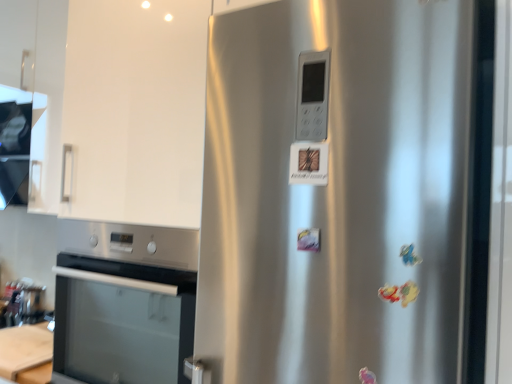
Question: In terms of size, does stainless steel oven at lower left appear bigger or smaller than brushed metal toaster at lower left?

Choices:
 (A) small
 (B) big

Answer: (B)

Question: Visually, is stainless steel oven at lower left positioned to the left or to the right of brushed metal toaster at lower left?

Choices:
 (A) right
 (B) left

Answer: (A)

Question: Based on their relative distances, which object is nearer to the wooden at lower left?

Choices:
 (A) satin silver fridge at center
 (B) satin white exhaust hood at upper left
 (C) brushed metal toaster at lower left
 (D) stainless steel oven at lower left
 (E) white glossy cabinet at upper left

Answer: (C)

Question: Estimate the real-world distances between objects in this image. Which object is closer to the wooden at lower left?

Choices:
 (A) white glossy cabinet at upper left
 (B) satin white exhaust hood at upper left
 (C) satin silver fridge at center
 (D) stainless steel oven at lower left
 (E) brushed metal toaster at lower left

Answer: (E)